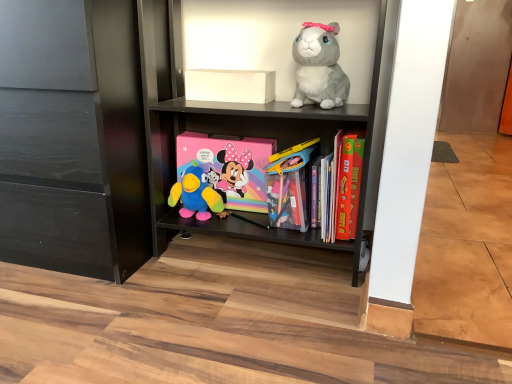
Question: Is there a large distance between white matte box at upper center and plush blue bird at center, the 1th toy from the left?

Choices:
 (A) yes
 (B) no

Answer: (B)

Question: Is white matte box at upper center smaller than plush blue bird at center, the 1th toy from the left?

Choices:
 (A) no
 (B) yes

Answer: (B)

Question: Does white matte box at upper center have a larger size compared to plush blue bird at center, the 3th toy viewed from the right?

Choices:
 (A) no
 (B) yes

Answer: (A)

Question: Is white matte box at upper center behind plush blue bird at center, the 1th toy from the left?

Choices:
 (A) yes
 (B) no

Answer: (A)

Question: From the image's perspective, is white matte box at upper center below plush blue bird at center, the 3th toy viewed from the right?

Choices:
 (A) no
 (B) yes

Answer: (A)

Question: Can you confirm if white matte box at upper center is thinner than plush blue bird at center, the 1th toy from the left?

Choices:
 (A) no
 (B) yes

Answer: (B)

Question: Is the depth of hardcover book at center right greater than that of pastel matte minnie mouse comic book at center?

Choices:
 (A) yes
 (B) no

Answer: (B)

Question: Is hardcover book at center right in contact with pastel matte minnie mouse comic book at center?

Choices:
 (A) no
 (B) yes

Answer: (A)

Question: Considering the relative positions of hardcover book at center right and pastel matte minnie mouse comic book at center in the image provided, is hardcover book at center right to the left of pastel matte minnie mouse comic book at center from the viewer's perspective?

Choices:
 (A) yes
 (B) no

Answer: (B)

Question: Can you confirm if hardcover book at center right is wider than pastel matte minnie mouse comic book at center?

Choices:
 (A) yes
 (B) no

Answer: (A)

Question: Is hardcover book at center right positioned beyond the bounds of pastel matte minnie mouse comic book at center?

Choices:
 (A) yes
 (B) no

Answer: (A)

Question: Is hardcover book at center right aimed at pastel matte minnie mouse comic book at center?

Choices:
 (A) no
 (B) yes

Answer: (A)

Question: Is fluffy gray plush rabbit at upper right, which ranks as the third toy in left-to-right order, to the left of pastel matte minnie mouse comic book at center from the viewer's perspective?

Choices:
 (A) yes
 (B) no

Answer: (B)